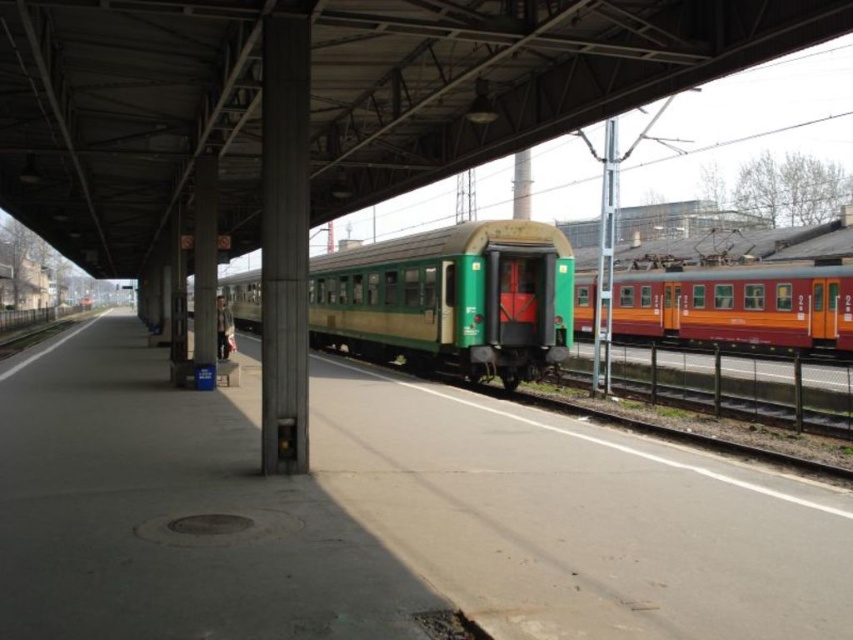
Locate an element on the screen. The width and height of the screenshot is (853, 640). green matte train at center is located at coordinates (450, 300).

Does point (346, 346) come closer to viewer compared to point (744, 278)?

That is False.

Which is behind, point (434, 241) or point (804, 266)?

The point (804, 266) is more distant.

The height and width of the screenshot is (640, 853). Identify the location of green matte train at center. (450, 300).